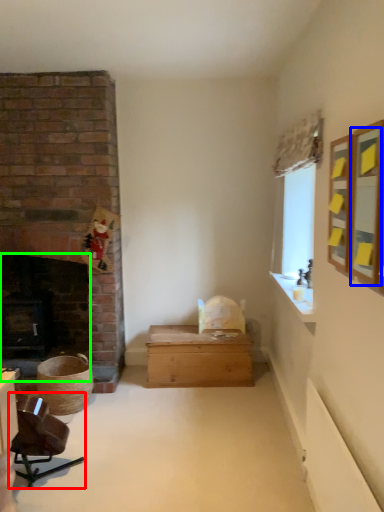
Question: Which is nearer to the chair (highlighted by a red box)? mirror (highlighted by a blue box) or fireplace (highlighted by a green box).

Choices:
 (A) mirror
 (B) fireplace

Answer: (B)